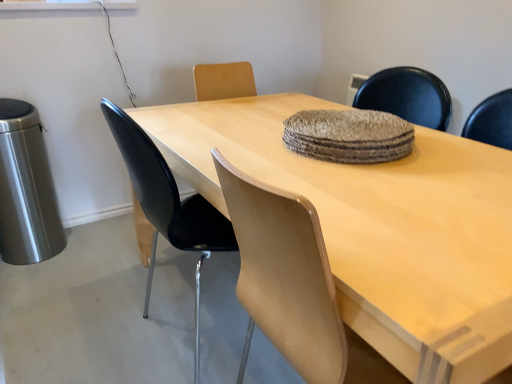
Find the location of a particular element. vacant point to the left of textured woven mat at center is located at coordinates (231, 142).